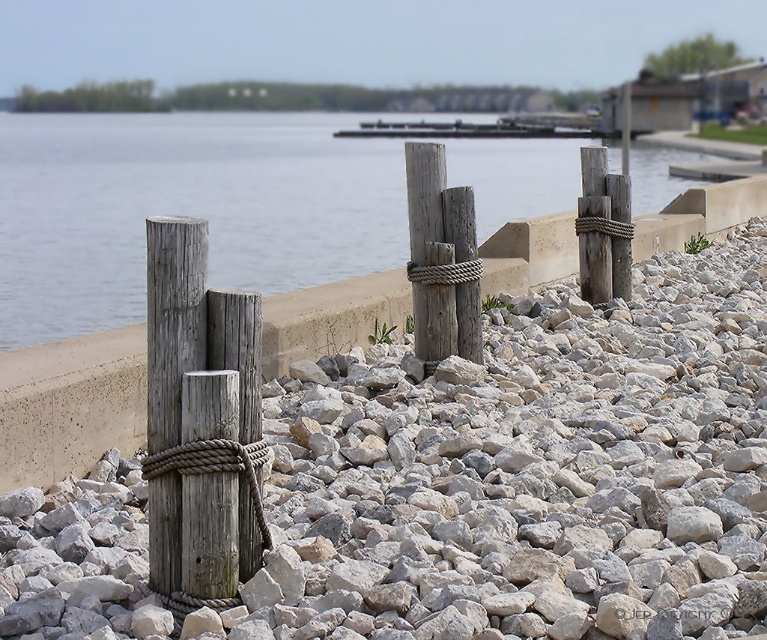
You are standing on the wooden dock at center and want to see the transparent water at center. In which direction should you look?

You should look to the left, since the transparent water at center is to the left of wooden dock at center.